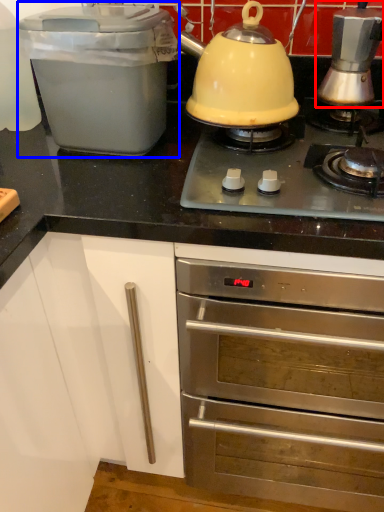
Question: Which point is closer to the camera, kitchen appliance (highlighted by a red box) or kitchen appliance (highlighted by a blue box)?

Choices:
 (A) kitchen appliance
 (B) kitchen appliance

Answer: (B)